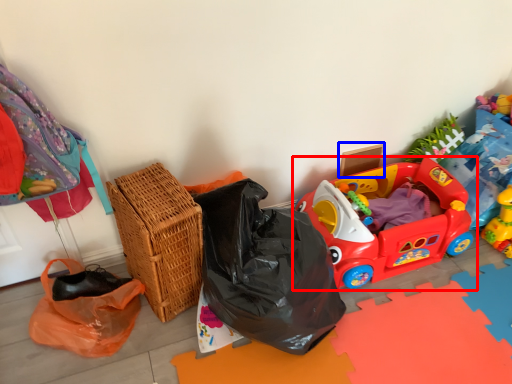
Question: Among these objects, which one is farthest to the camera, toy (highlighted by a red box) or cardboard box (highlighted by a blue box)?

Choices:
 (A) toy
 (B) cardboard box

Answer: (B)